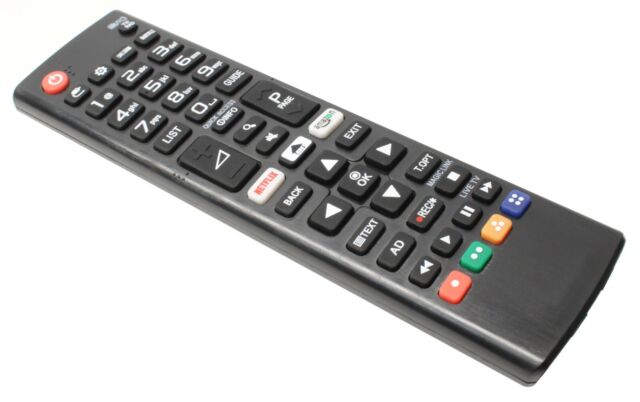
At what (x,y) coordinates should I click in order to perform the action: click on arrow buttons on remote control. Please return your answer as a coordinate pair (x, y). Looking at the image, I should click on (335, 165), (323, 216), (385, 151), (390, 194), (422, 268), (445, 241), (482, 188).